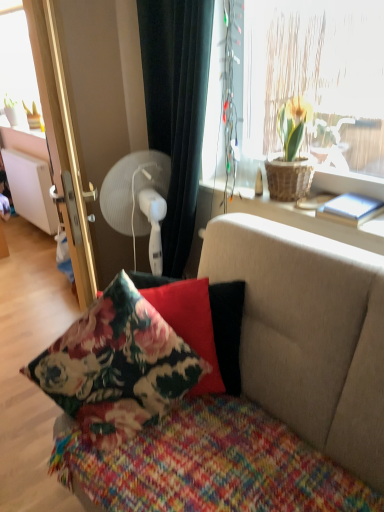
Question: Is knitted multicolored blanket at center wider than woven wicker basket at upper right?

Choices:
 (A) yes
 (B) no

Answer: (A)

Question: From the image's perspective, is knitted multicolored blanket at center below woven wicker basket at upper right?

Choices:
 (A) yes
 (B) no

Answer: (A)

Question: Considering the relative sizes of knitted multicolored blanket at center and woven wicker basket at upper right in the image provided, is knitted multicolored blanket at center bigger than woven wicker basket at upper right?

Choices:
 (A) no
 (B) yes

Answer: (B)

Question: Is knitted multicolored blanket at center thinner than woven wicker basket at upper right?

Choices:
 (A) no
 (B) yes

Answer: (A)

Question: Is knitted multicolored blanket at center closer to camera compared to woven wicker basket at upper right?

Choices:
 (A) no
 (B) yes

Answer: (B)

Question: Does knitted multicolored blanket at center contain woven wicker basket at upper right?

Choices:
 (A) yes
 (B) no

Answer: (B)

Question: Is white plastic fan at upper left facing towards knitted multicolored blanket at center?

Choices:
 (A) no
 (B) yes

Answer: (A)

Question: Would you say white plastic fan at upper left contains knitted multicolored blanket at center?

Choices:
 (A) yes
 (B) no

Answer: (B)

Question: Is white plastic fan at upper left positioned far away from knitted multicolored blanket at center?

Choices:
 (A) no
 (B) yes

Answer: (B)

Question: Is knitted multicolored blanket at center at the back of white plastic fan at upper left?

Choices:
 (A) no
 (B) yes

Answer: (B)

Question: Is white plastic fan at upper left at the left side of knitted multicolored blanket at center?

Choices:
 (A) no
 (B) yes

Answer: (B)

Question: Is white plastic fan at upper left smaller than knitted multicolored blanket at center?

Choices:
 (A) no
 (B) yes

Answer: (B)

Question: Is floral fabric couch at center positioned far away from floral fabric pillow at center, the 1th pillow from the back?

Choices:
 (A) yes
 (B) no

Answer: (B)